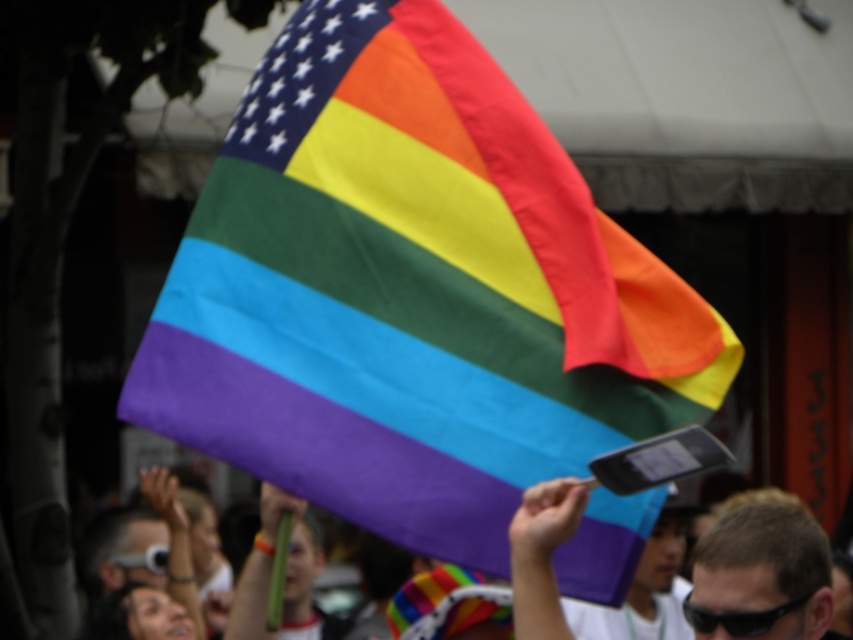
Question: Can you confirm if rainbow fabric flag at upper center is positioned below matte black sunglasses at lower left?

Choices:
 (A) no
 (B) yes

Answer: (A)

Question: Which point is farther from the camera taking this photo?

Choices:
 (A) (117, 545)
 (B) (352, 262)
 (C) (802, 552)

Answer: (A)

Question: Is rainbow fabric flag at upper center further to camera compared to matte black sunglasses at lower left?

Choices:
 (A) no
 (B) yes

Answer: (A)

Question: Which object is farther from the camera taking this photo?

Choices:
 (A) matte black sunglasses at lower left
 (B) black plastic goggles at upper center
 (C) rainbow fabric flag at upper center

Answer: (A)

Question: Where is rainbow fabric flag at upper center located in relation to matte black sunglasses at lower left in the image?

Choices:
 (A) right
 (B) left

Answer: (A)

Question: Which point is farther to the camera?

Choices:
 (A) short brown hair at center
 (B) matte black sunglasses at lower left

Answer: (B)